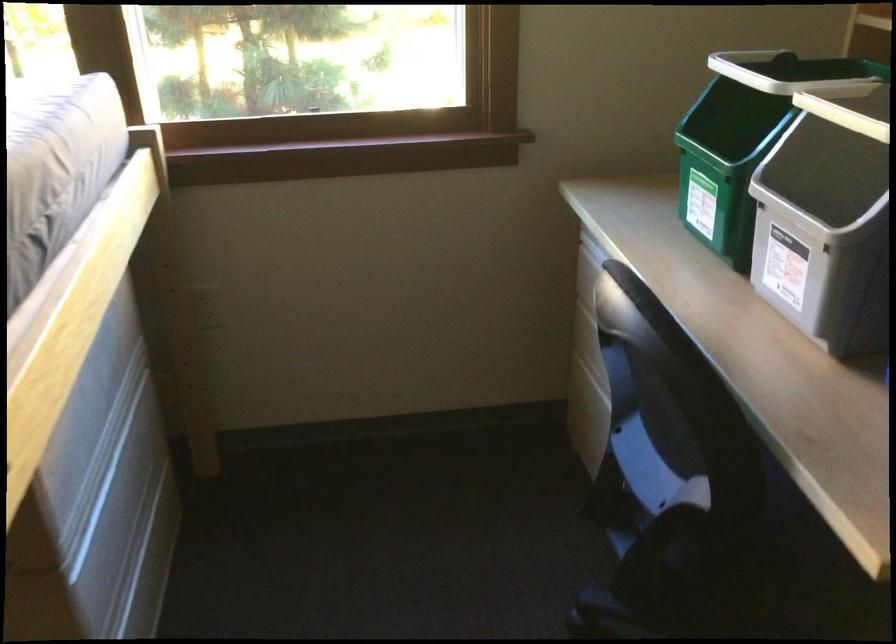
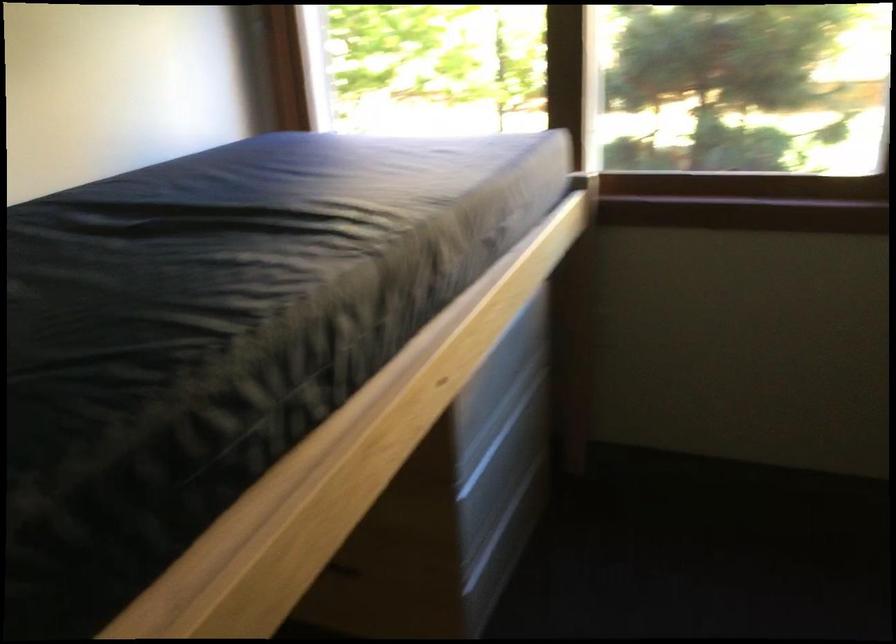
Question: Based on the continuous images, in which direction is the camera rotating? Reply with the corresponding letter.

Choices:
 (A) Left
 (B) Right
 (C) Up
 (D) Down

Answer: (A)